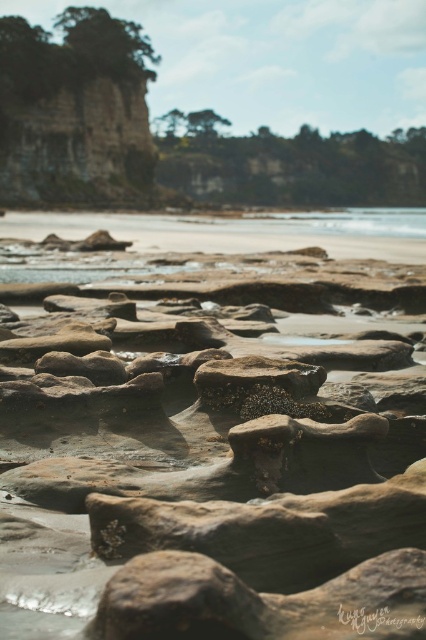
Question: Is smooth sandstone rock at center below clear water at center?

Choices:
 (A) no
 (B) yes

Answer: (B)

Question: Which of the following is the closest to the observer?

Choices:
 (A) (367, 212)
 (B) (233, 528)

Answer: (B)

Question: Is smooth sandstone rock at center bigger than clear water at center?

Choices:
 (A) yes
 (B) no

Answer: (B)

Question: Which object appears closest to the camera in this image?

Choices:
 (A) clear water at center
 (B) smooth sandstone rock at center

Answer: (B)

Question: Is smooth sandstone rock at center closer to the viewer compared to clear water at center?

Choices:
 (A) no
 (B) yes

Answer: (B)

Question: Which object is closer to the camera taking this photo?

Choices:
 (A) smooth sandstone rock at center
 (B) clear water at center

Answer: (A)